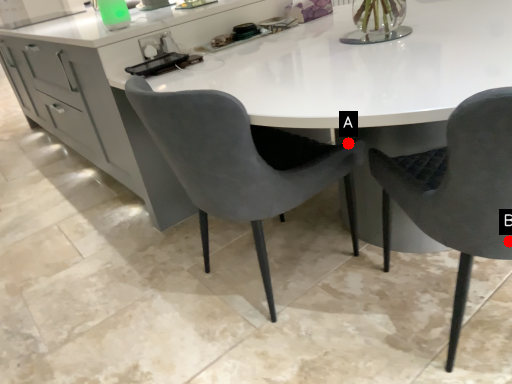
Question: Two points are circled on the image, labeled by A and B beside each circle. Which of the following is the closest to the observer?

Choices:
 (A) A is closer
 (B) B is closer

Answer: (B)